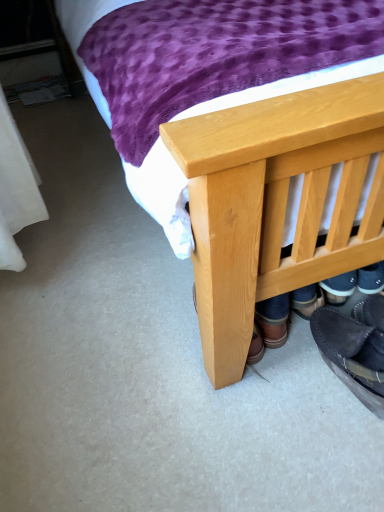
Question: From their relative heights in the image, would you say natural wood bed at center is taller or shorter than dark brown leather shoe at lower right?

Choices:
 (A) tall
 (B) short

Answer: (A)

Question: Considering the positions of natural wood bed at center and dark brown leather shoe at lower right in the image, is natural wood bed at center bigger or smaller than dark brown leather shoe at lower right?

Choices:
 (A) small
 (B) big

Answer: (B)

Question: From the image's perspective, relative to dark brown leather shoe at lower right, is natural wood bed at center above or below?

Choices:
 (A) above
 (B) below

Answer: (A)

Question: From the image's perspective, is dark brown leather shoe at lower right positioned above or below natural wood bed at center?

Choices:
 (A) below
 (B) above

Answer: (A)

Question: Is dark brown leather shoe at lower right taller or shorter than natural wood bed at center?

Choices:
 (A) tall
 (B) short

Answer: (B)

Question: Is dark brown leather shoe at lower right wider or thinner than natural wood bed at center?

Choices:
 (A) thin
 (B) wide

Answer: (A)

Question: Based on their sizes in the image, would you say dark brown leather shoe at lower right is bigger or smaller than natural wood bed at center?

Choices:
 (A) big
 (B) small

Answer: (B)